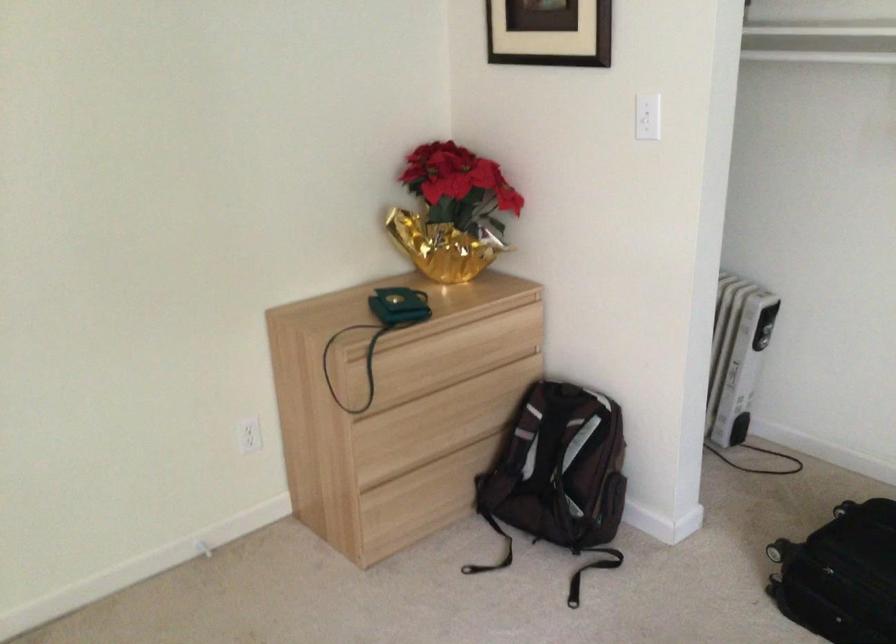
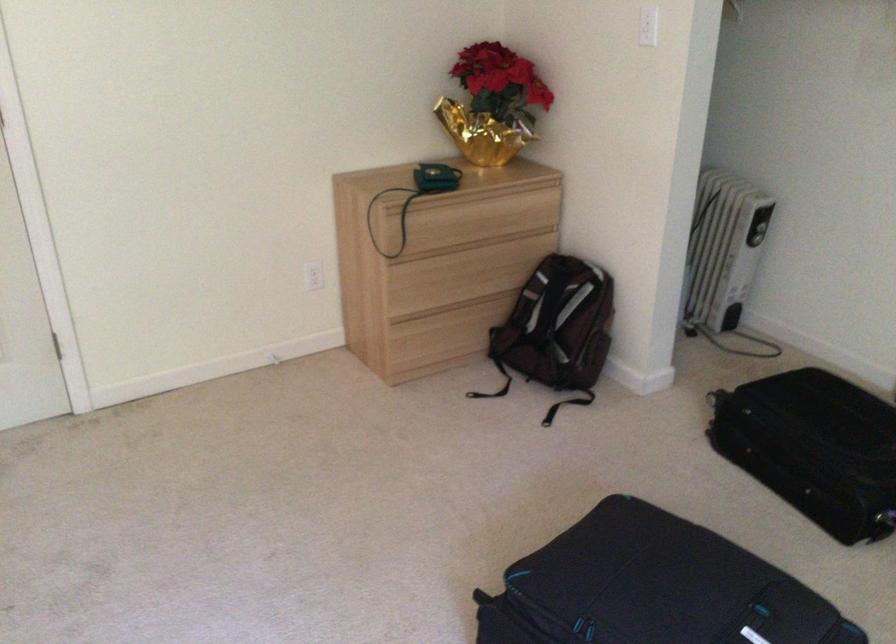
Find the pixel in the second image that matches point 470,339 in the first image.

(492, 210)